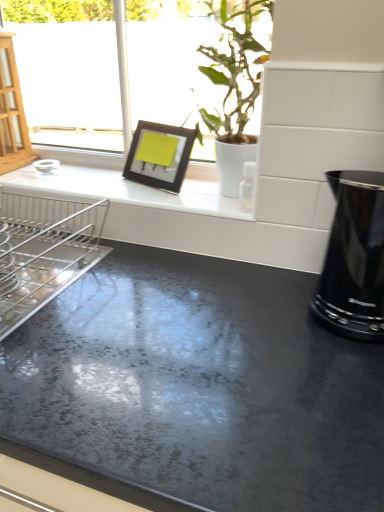
Question: From the image's perspective, is white glossy countertop at upper center above or below green leafy plant at upper center?

Choices:
 (A) below
 (B) above

Answer: (A)

Question: From their relative heights in the image, would you say white glossy countertop at upper center is taller or shorter than green leafy plant at upper center?

Choices:
 (A) short
 (B) tall

Answer: (A)

Question: Estimate the real-world distances between objects in this image. Which object is closer to the white glossy countertop at upper center?

Choices:
 (A) black matte picture frame at upper center
 (B) silver metallic dish rack at left
 (C) black glossy kettle at right
 (D) green leafy plant at upper center

Answer: (A)

Question: Which is farther from the white glossy countertop at upper center?

Choices:
 (A) black glossy kettle at right
 (B) silver metallic dish rack at left
 (C) green leafy plant at upper center
 (D) black matte picture frame at upper center

Answer: (A)